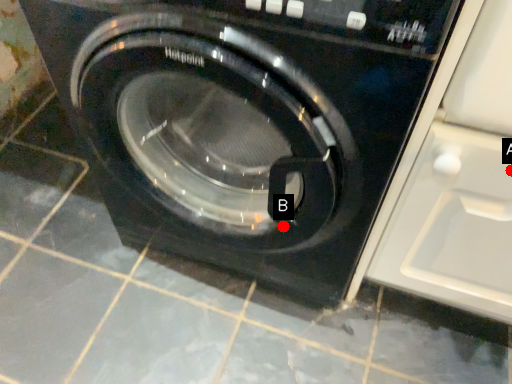
Question: Two points are circled on the image, labeled by A and B beside each circle. Which point is farther from the camera taking this photo?

Choices:
 (A) A is further
 (B) B is further

Answer: (B)